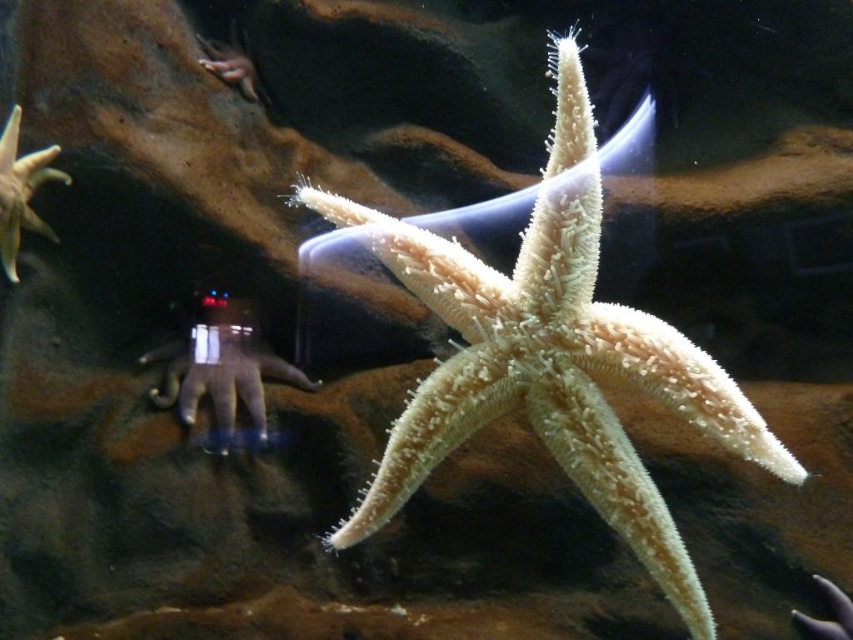
Question: Which object appears farthest from the camera in this image?

Choices:
 (A) smooth beige starfish at left
 (B) metallic silver robot at lower center

Answer: (B)

Question: Which point is closer to the camera taking this photo?

Choices:
 (A) (544, 356)
 (B) (12, 218)
 (C) (216, 371)

Answer: (A)

Question: Observing the image, what is the correct spatial positioning of sandy beige starfish at center in reference to metallic silver robot at lower center?

Choices:
 (A) below
 (B) above

Answer: (B)

Question: From the image, what is the correct spatial relationship of sandy beige starfish at center in relation to smooth beige starfish at left?

Choices:
 (A) right
 (B) left

Answer: (A)

Question: Among these objects, which one is nearest to the camera?

Choices:
 (A) metallic silver robot at lower center
 (B) sandy beige starfish at center
 (C) smooth beige starfish at left

Answer: (B)

Question: From the image, what is the correct spatial relationship of sandy beige starfish at center in relation to metallic silver robot at lower center?

Choices:
 (A) below
 (B) above

Answer: (B)